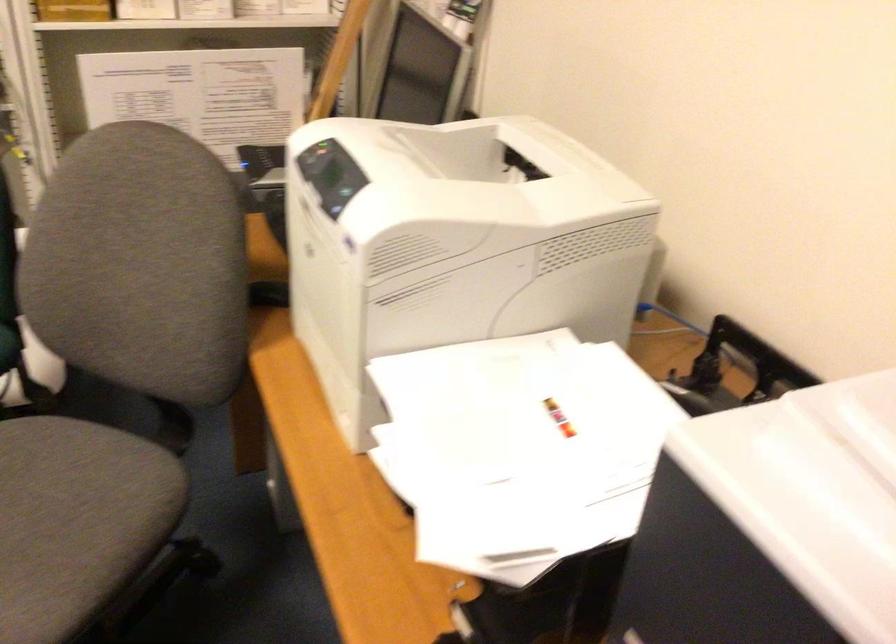
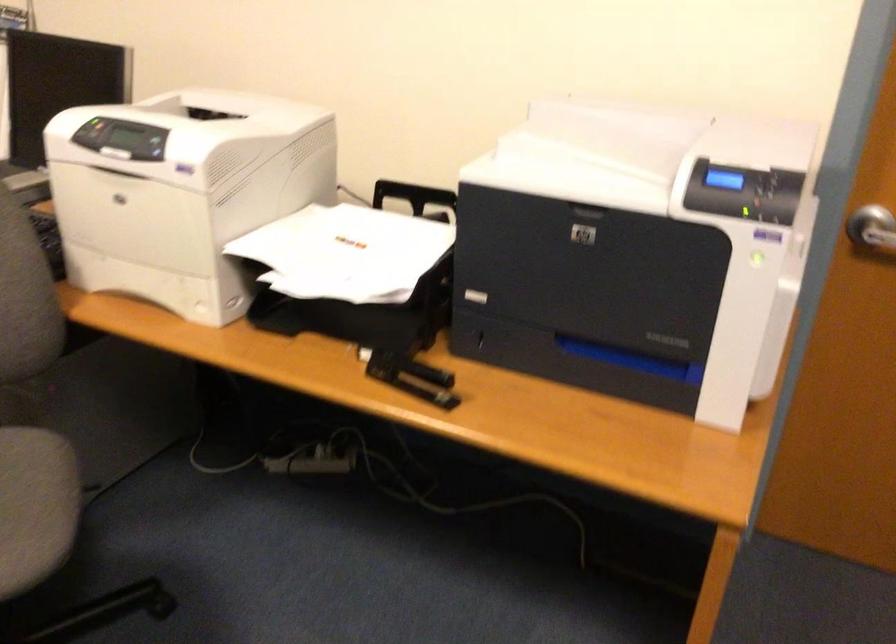
Find the pixel in the second image that matches (312,158) in the first image.

(91, 131)